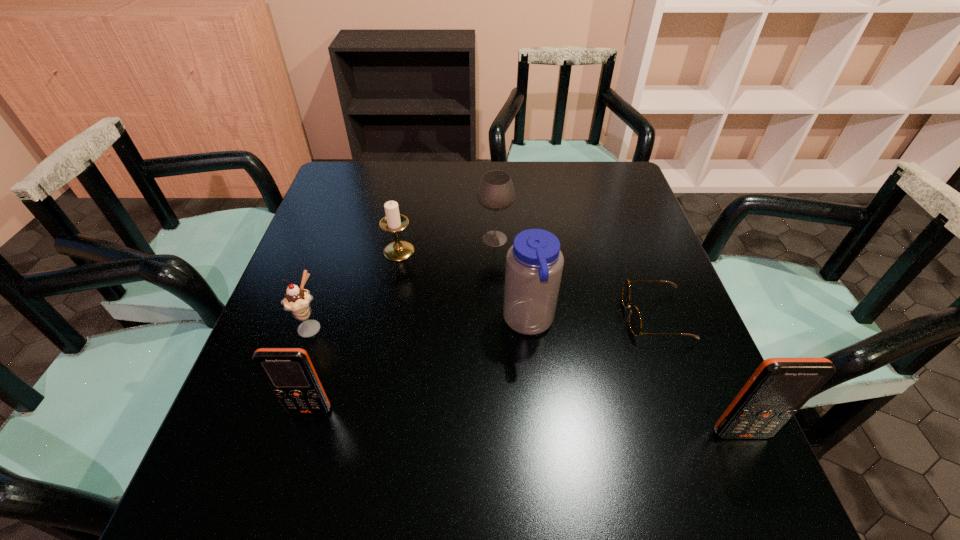
What are the coordinates of `the farther cellular telephone` in the screenshot? It's located at (289, 373).

This screenshot has height=540, width=960. Find the location of `the left cellular telephone`. the left cellular telephone is located at coordinates (289, 373).

I want to click on the nearer cellular telephone, so pos(779,387).

This screenshot has height=540, width=960. In order to click on the right cellular telephone in this screenshot , I will do `click(779, 387)`.

Identify the location of wineglass. Image resolution: width=960 pixels, height=540 pixels. (495, 192).

I want to click on the third object from left to right, so click(x=398, y=250).

This screenshot has width=960, height=540. Find the location of `sunglasses`. sunglasses is located at coordinates (635, 322).

This screenshot has width=960, height=540. In order to click on water bottle in this screenshot , I will do (534, 263).

The image size is (960, 540). I want to click on icecream, so click(297, 300).

Where is `vacant space situated 0.080m on the right of the wineglass`? Image resolution: width=960 pixels, height=540 pixels. vacant space situated 0.080m on the right of the wineglass is located at coordinates (542, 239).